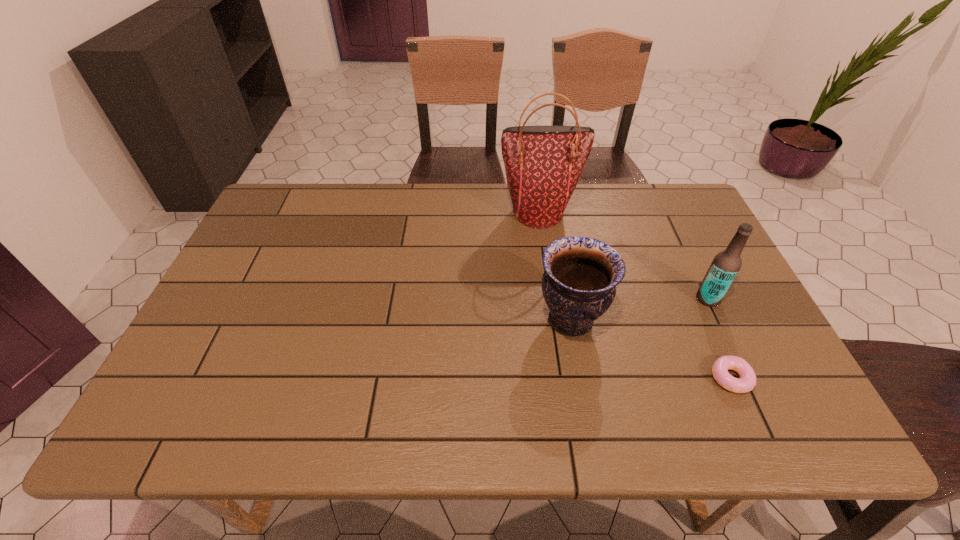
Image resolution: width=960 pixels, height=540 pixels. Find the location of `vacant space located 0.230m on the front handle of the third tallest object`. vacant space located 0.230m on the front handle of the third tallest object is located at coordinates (443, 320).

You are a GUI agent. You are given a task and a screenshot of the screen. Output one action in this format:
    pyautogui.click(x=<x>, y=<y>)
    Task: Click on the vacant area situated 0.120m on the front handle of the third tallest object
    This screenshot has height=540, width=960.
    Given the screenshot: What is the action you would take?
    pyautogui.click(x=487, y=320)

At what (x,y) coordinates should I click in order to perform the action: click on free space located 0.100m on the front handle of the third tallest object. Please return your answer as a coordinate pair (x, y). Looking at the image, I should click on (494, 320).

Locate an element on the screen. Image resolution: width=960 pixels, height=540 pixels. free space located on the left of the shortest object is located at coordinates (612, 379).

Identify the location of object at the far edge. (543, 164).

Find the location of `beer bottle that is at the right edge`. beer bottle that is at the right edge is located at coordinates (725, 266).

Where is `doughnut at the right edge`? This screenshot has width=960, height=540. doughnut at the right edge is located at coordinates (747, 381).

This screenshot has height=540, width=960. Identify the location of vacant space at the far edge. (407, 227).

In the image, there is a desktop. Identify the location of vacant space at the near edge. The height and width of the screenshot is (540, 960). (619, 425).

Image resolution: width=960 pixels, height=540 pixels. In the image, there is a desktop. Find the location of `vacant space at the right edge`. vacant space at the right edge is located at coordinates (692, 281).